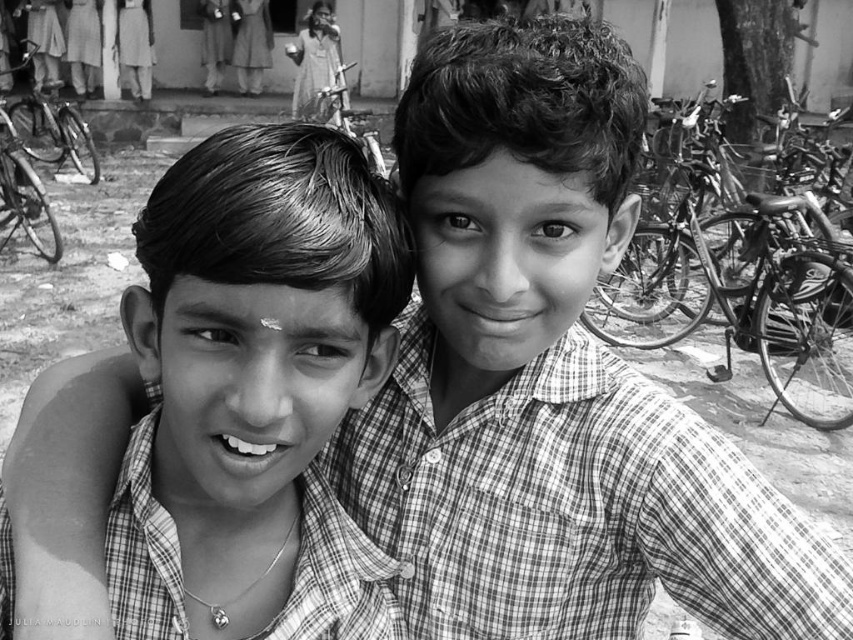
Is checkered fabric shirt at center to the left of metallic silver bicycle at right from the viewer's perspective?

Yes, checkered fabric shirt at center is to the left of metallic silver bicycle at right.

Measure the distance between point (x=265, y=262) and camera.

A distance of 32.52 inches exists between point (x=265, y=262) and camera.

The height and width of the screenshot is (640, 853). What are the coordinates of `checkered fabric shirt at center` in the screenshot? It's located at (251, 378).